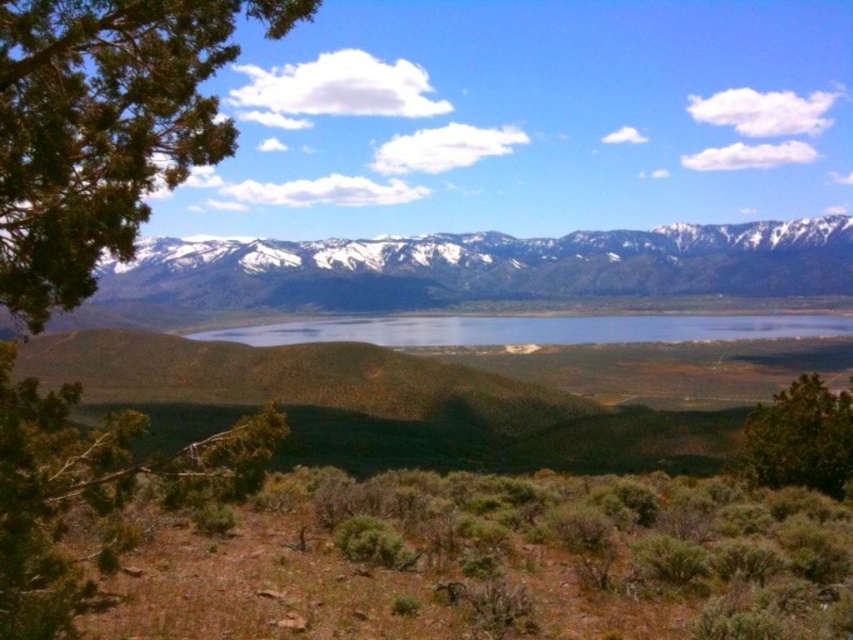
You are a hiker planning to take a photo of the snowy rock mountain range at upper center. You notice a green leafy tree at left in your camera frame. Based on their positions, will the tree block the view of the mountain range?

The green leafy tree at left is located below the snowy rock mountain range at upper center, so the tree will not block the view of the mountain range as it is positioned lower in the frame.

You are a hiker planning to take a photo of both the snowy rock mountain range at upper center and the clear blue water at center. Which object should you focus on first if you want to capture both in one frame without moving the camera?

The snowy rock mountain range at upper center is bigger than the clear blue water at center, so you should focus on the snowy rock mountain range at upper center first to ensure it fits properly in the frame before adjusting for the smaller clear blue water at center.